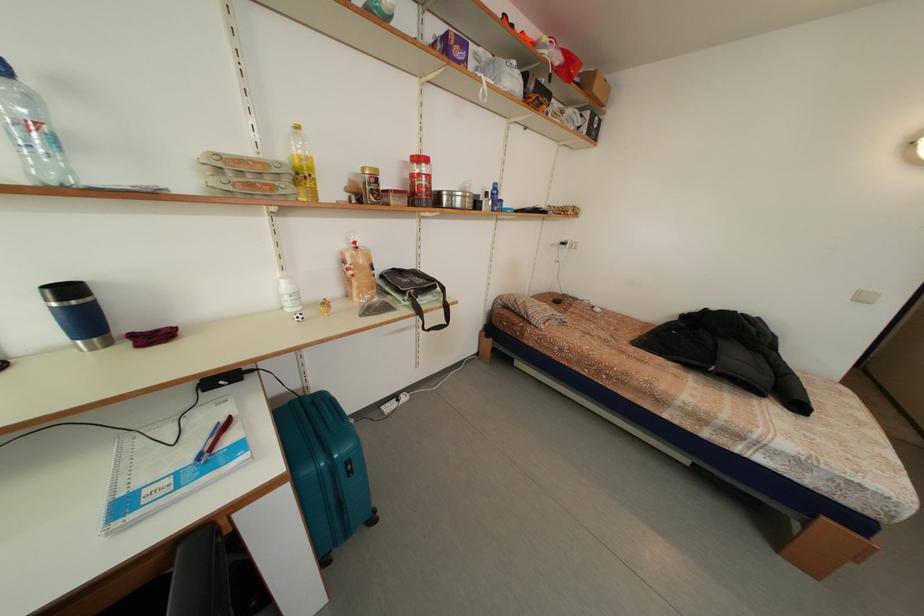
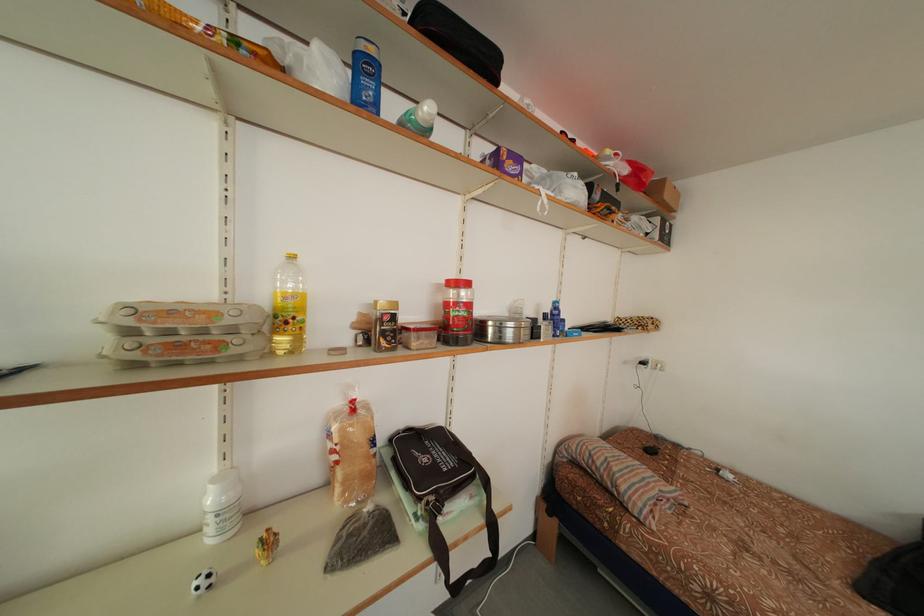
Find the pixel in the second image that matches point (310, 172) in the first image.

(292, 314)